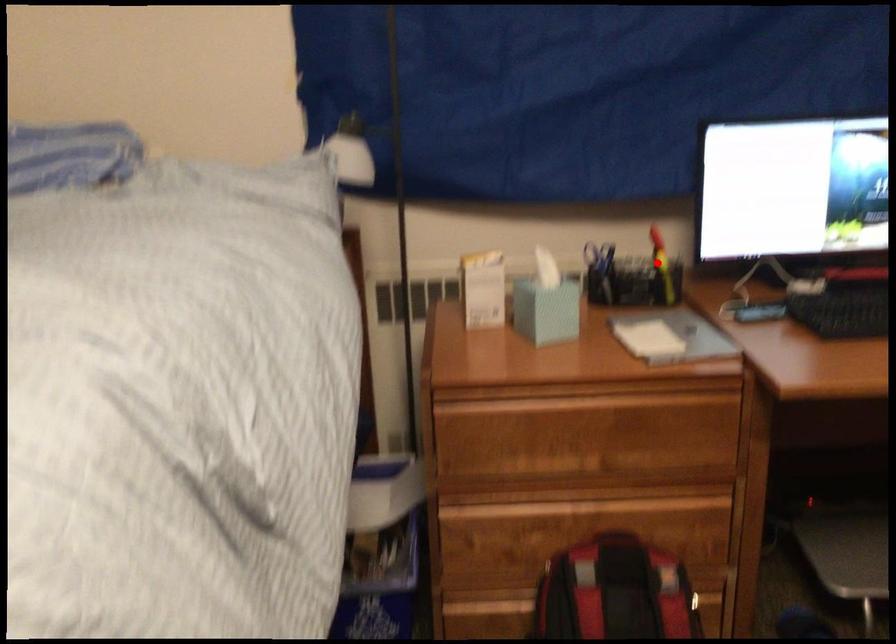
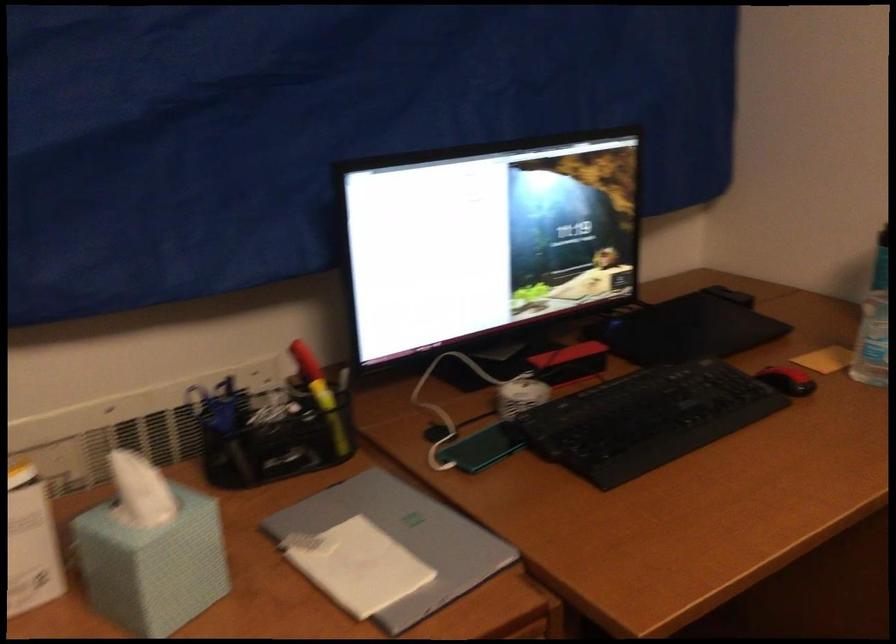
Locate, in the second image, the point that corresponds to the highlighted location in the first image.

(321, 395)